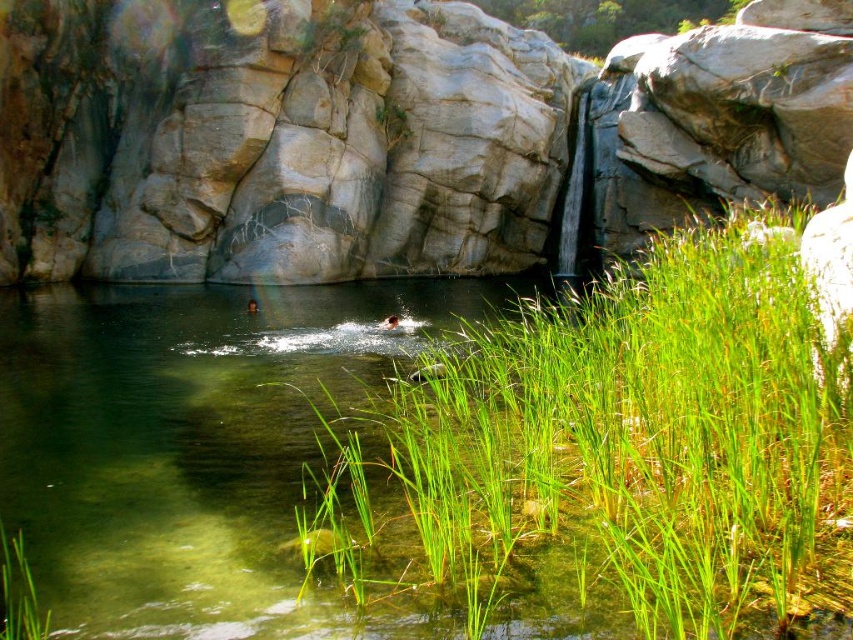
Question: Which point is farther to the camera?

Choices:
 (A) green grass at center
 (B) gray/rough rock at center

Answer: (B)

Question: Does gray/rough rock at center have a smaller size compared to green grass at lower left?

Choices:
 (A) yes
 (B) no

Answer: (B)

Question: Which of the following is the farthest from the observer?

Choices:
 (A) green grass at lower left
 (B) green grass at center

Answer: (A)

Question: Is green grass at center wider than green grass at lower left?

Choices:
 (A) yes
 (B) no

Answer: (A)

Question: Can you confirm if gray/rough rock at center is positioned below green grass at center?

Choices:
 (A) no
 (B) yes

Answer: (A)

Question: Which point is closer to the camera taking this photo?

Choices:
 (A) (7, 561)
 (B) (630, 408)
 (C) (207, 90)

Answer: (A)